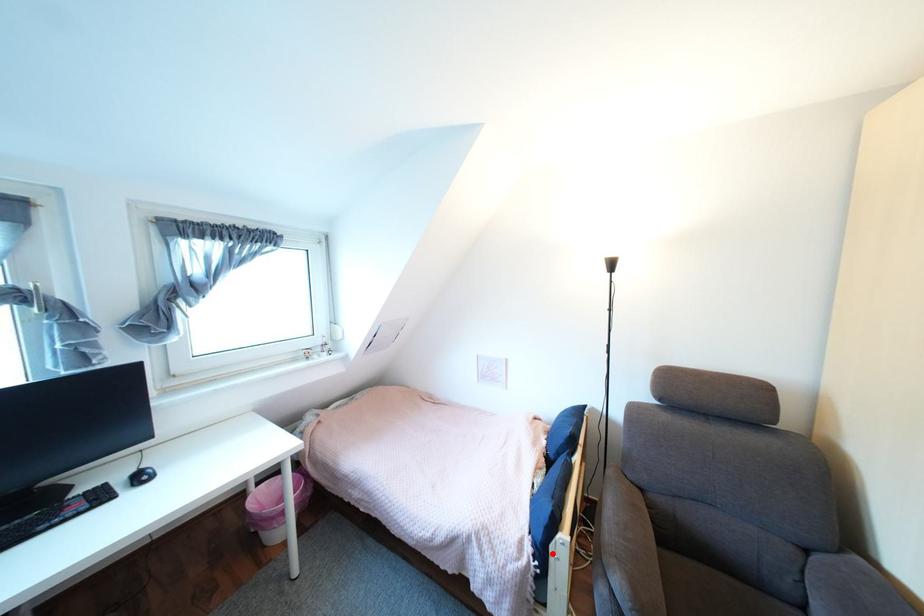
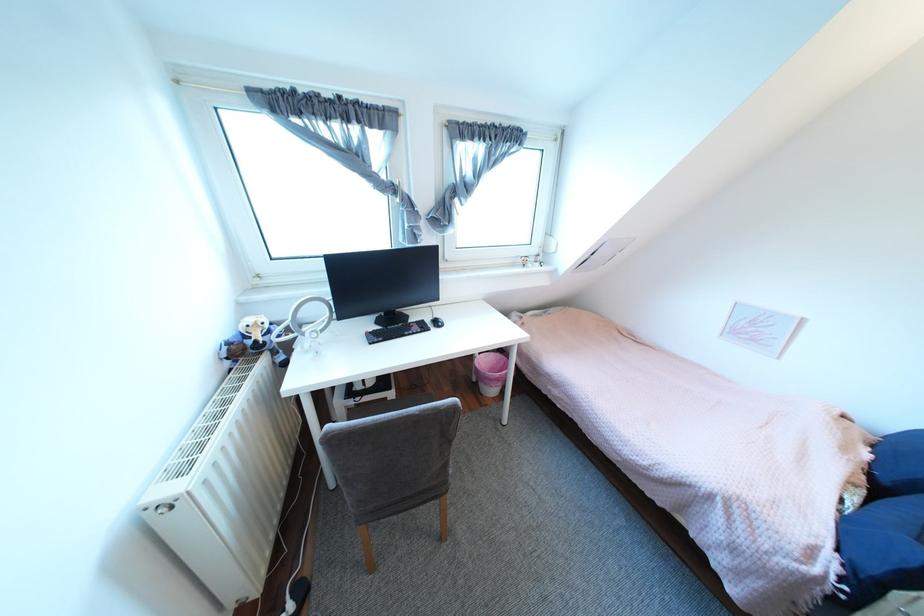
Question: I am providing you with two images of the same scene from different viewpoints. Given a red point in image1, look at the same physical point in image2. Is it:

Choices:
 (A) Closer to the viewpoint
 (B) Farther from the viewpoint

Answer: (A)